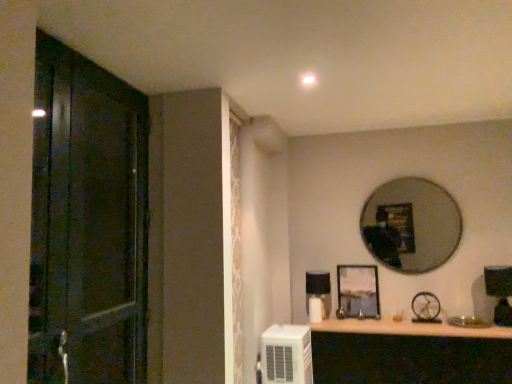
Locate an element on the screen. vacant area in front of metallic silver clock at upper right is located at coordinates (432, 328).